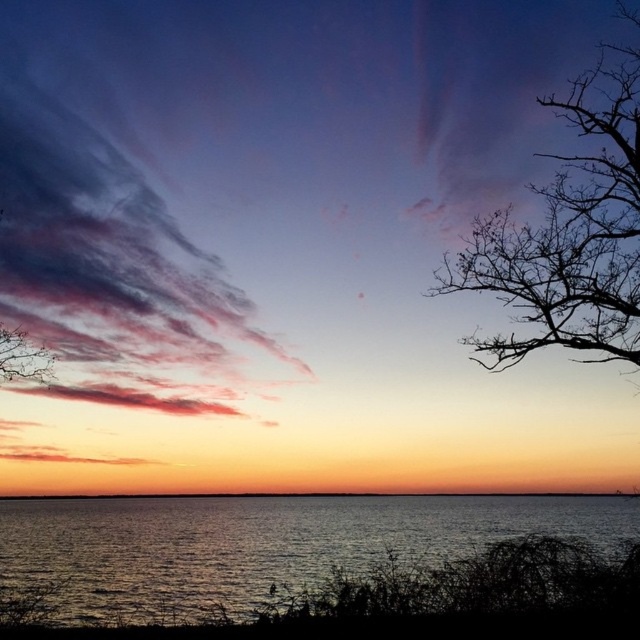
You are standing on the shore of the lake and see the point marked at coordinates (257,541). Based on the scene description, can you determine what surface this point is located on?

The point is located on the glistening silver water at lower center, as stated in the object description.

You are standing on a boat in the middle of the lake and looking at the scene. Which object, the pastel cotton clouds at upper left or the smooth orange water at center, would appear nearer to you?

The pastel cotton clouds at upper left appear nearer to you because they are closer to the viewer than the smooth orange water at center.